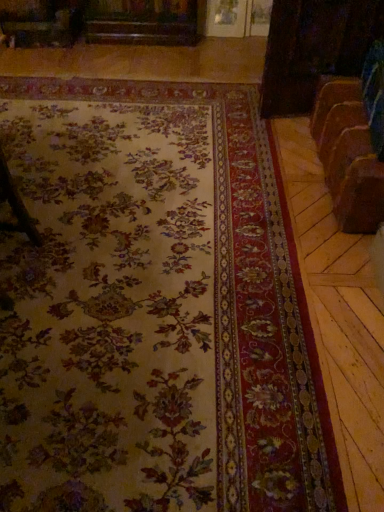
Where is `brown leather couch at right`? brown leather couch at right is located at coordinates (348, 155).

What do you see at coordinates (348, 155) in the screenshot? The height and width of the screenshot is (512, 384). I see `brown leather couch at right` at bounding box center [348, 155].

In order to face brown leather couch at right, should I rotate leftwards or rightwards?

It's best to rotate right around 22.471 degrees.

Measure the distance between point (321,118) and camera.

Point (321,118) and camera are 2.22 meters apart from each other.

The height and width of the screenshot is (512, 384). Identify the location of brown leather couch at right. (348, 155).